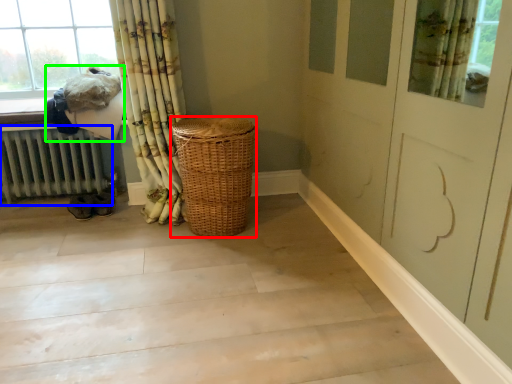
Question: Which is farther away from basket (highlighted by a red box)? radiator (highlighted by a blue box) or laundry (highlighted by a green box)?

Choices:
 (A) radiator
 (B) laundry

Answer: (A)